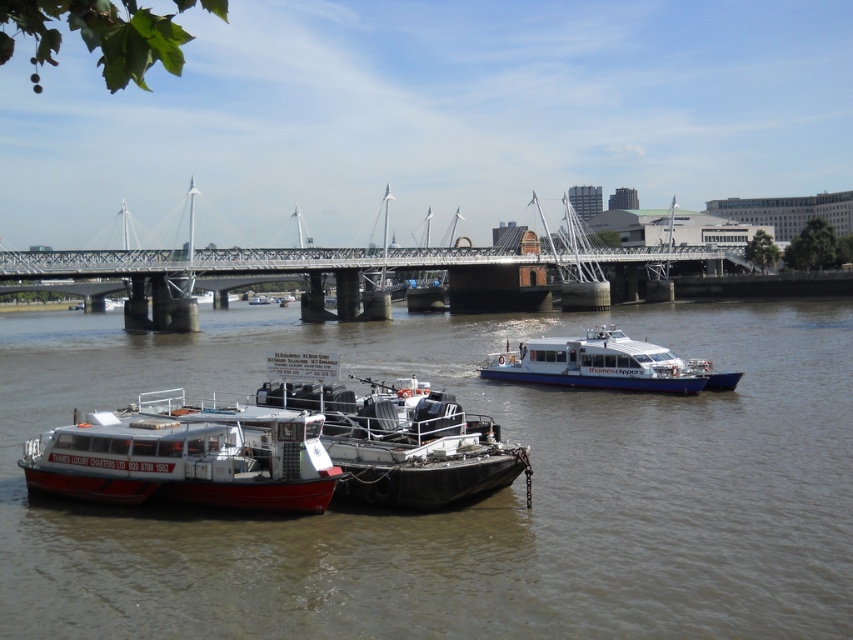
You are standing at the origin point of the coordinate system with the bottom left corner of the image as the origin. You want to locate the white matte boat at lower left. What are its coordinates?

The white matte boat at lower left is located at coordinates point (186, 456).

You are a boat operator who needs to navigate a new vessel through the river. The vessel requires a minimum of 10 meters of clearance between it and any other object for safe passage. Based on the scene, can you safely maneuver your vessel between the brown matte water at center and the white glossy ferry boat at center?

The brown matte water at center is 12.44 meters from the white glossy ferry boat at center. Since the required minimum clearance is 10 meters, the 12.44 meters distance allows safe passage between them.

You are standing at the riverside and want to determine which of the two points, point (387, 540) or point (608, 342), is closer to you. Based on the scene, which point is nearer?

Point (387, 540) is closer to the viewer than point (608, 342).